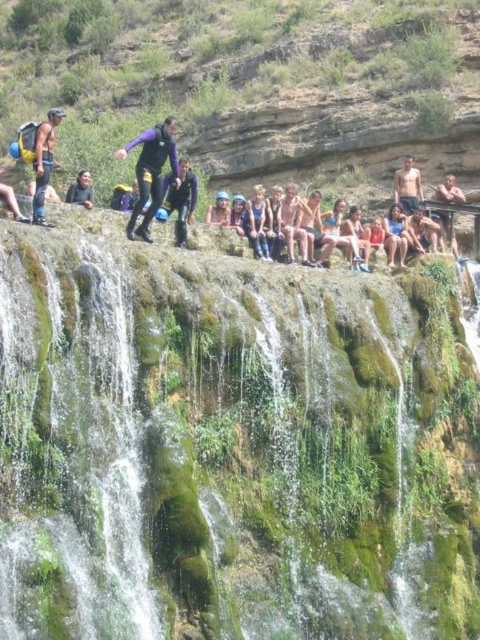
Is green mossy rock at center in front of matte black wetsuit at left?

Yes, it is in front of matte black wetsuit at left.

Locate an element on the screen. The image size is (480, 640). green mossy rock at center is located at coordinates (230, 444).

Does purple matte wetsuit at center have a lesser width compared to skinny man at upper right?

No, purple matte wetsuit at center is not thinner than skinny man at upper right.

Is purple matte wetsuit at center wider than skinny man at upper right?

Correct, the width of purple matte wetsuit at center exceeds that of skinny man at upper right.

Who is more distant from viewer, [140,212] or [407,170]?

The point [407,170] is behind.

Identify the location of purple matte wetsuit at center. The width and height of the screenshot is (480, 640). (151, 172).

Can you confirm if purple matte wetsuit at center is positioned above matte black wetsuit at center?

Correct, purple matte wetsuit at center is located above matte black wetsuit at center.

Is purple matte wetsuit at center shorter than matte black wetsuit at center?

No, purple matte wetsuit at center is not shorter than matte black wetsuit at center.

Is point (155, 205) in front of point (79, 198)?

Yes, point (155, 205) is closer to viewer.

You are a GUI agent. You are given a task and a screenshot of the screen. Output one action in this format:
    pyautogui.click(x=<x>, y=<y>)
    Task: Click on the purple matte wetsuit at center
    Image resolution: width=480 pixels, height=640 pixels.
    Given the screenshot: What is the action you would take?
    pyautogui.click(x=151, y=172)